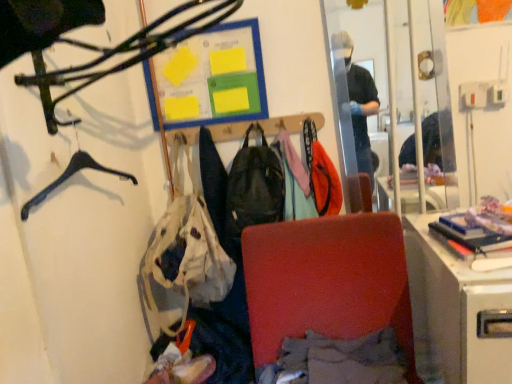
Question: Does hardcover book at right have a lesser height compared to white fabric handbag at center?

Choices:
 (A) no
 (B) yes

Answer: (B)

Question: Is hardcover book at right to the left of white fabric handbag at center from the viewer's perspective?

Choices:
 (A) yes
 (B) no

Answer: (B)

Question: Can you confirm if hardcover book at right is bigger than white fabric handbag at center?

Choices:
 (A) no
 (B) yes

Answer: (A)

Question: Can you confirm if hardcover book at right is smaller than white fabric handbag at center?

Choices:
 (A) yes
 (B) no

Answer: (A)

Question: Is hardcover book at right in front of white fabric handbag at center?

Choices:
 (A) yes
 (B) no

Answer: (A)

Question: From the image's perspective, is hardcover book at right located beneath white fabric handbag at center?

Choices:
 (A) yes
 (B) no

Answer: (B)

Question: Is velvet red chair at center in contact with white fabric handbag at center?

Choices:
 (A) no
 (B) yes

Answer: (A)

Question: From the image's perspective, would you say velvet red chair at center is shown under white fabric handbag at center?

Choices:
 (A) yes
 (B) no

Answer: (A)

Question: From the image's perspective, is velvet red chair at center above white fabric handbag at center?

Choices:
 (A) no
 (B) yes

Answer: (A)

Question: Does velvet red chair at center have a greater height compared to white fabric handbag at center?

Choices:
 (A) yes
 (B) no

Answer: (B)

Question: Considering the relative sizes of velvet red chair at center and white fabric handbag at center in the image provided, is velvet red chair at center smaller than white fabric handbag at center?

Choices:
 (A) yes
 (B) no

Answer: (B)

Question: Is velvet red chair at center not inside white fabric handbag at center?

Choices:
 (A) no
 (B) yes

Answer: (B)

Question: From a real-world perspective, does clear glass mirror at upper right sit lower than matte black hanger at upper left?

Choices:
 (A) yes
 (B) no

Answer: (A)